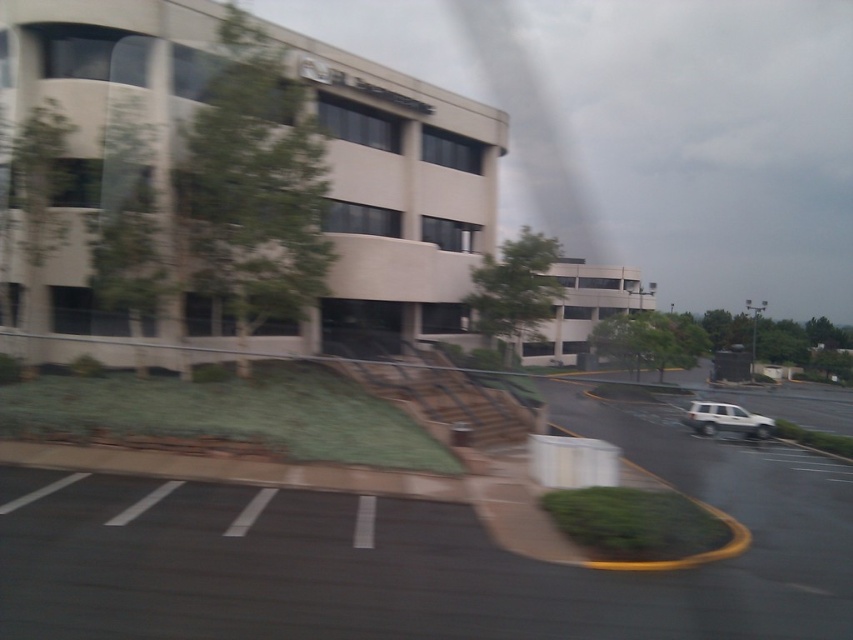
Can you confirm if black asphalt parking lot at lower left is smaller than white matte suv at lower right?

Actually, black asphalt parking lot at lower left might be larger than white matte suv at lower right.

This screenshot has width=853, height=640. What do you see at coordinates (431, 556) in the screenshot?
I see `black asphalt parking lot at lower left` at bounding box center [431, 556].

Locate an element on the screen. The height and width of the screenshot is (640, 853). black asphalt parking lot at lower left is located at coordinates (431, 556).